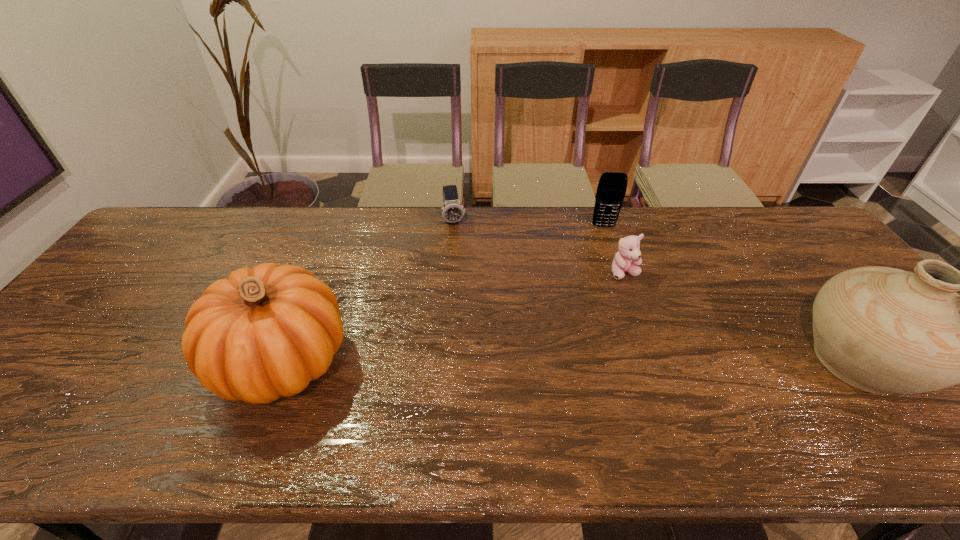
Where is `pumpkin`? pumpkin is located at coordinates (264, 332).

Identify the location of the third tallest object. (611, 190).

Locate an element on the screen. This screenshot has height=540, width=960. watch is located at coordinates (452, 211).

At what (x,y) coordinates should I click in order to perform the action: click on teddy bear. Please return your answer as a coordinate pair (x, y). Looking at the image, I should click on (626, 260).

Locate an element on the screen. Image resolution: width=960 pixels, height=540 pixels. free point located on the left of the pumpkin is located at coordinates (71, 361).

Where is `vacant area situated 0.350m on the screen of the cellular telephone`? The width and height of the screenshot is (960, 540). vacant area situated 0.350m on the screen of the cellular telephone is located at coordinates (620, 308).

The height and width of the screenshot is (540, 960). I want to click on free location located on the screen of the cellular telephone, so click(x=609, y=254).

In order to click on vacant space located on the screen of the cellular telephone in this screenshot , I will do `click(608, 252)`.

Image resolution: width=960 pixels, height=540 pixels. I want to click on vacant area situated on the face of the watch, so [x=476, y=322].

This screenshot has height=540, width=960. Identify the location of free region located on the face of the watch. (472, 306).